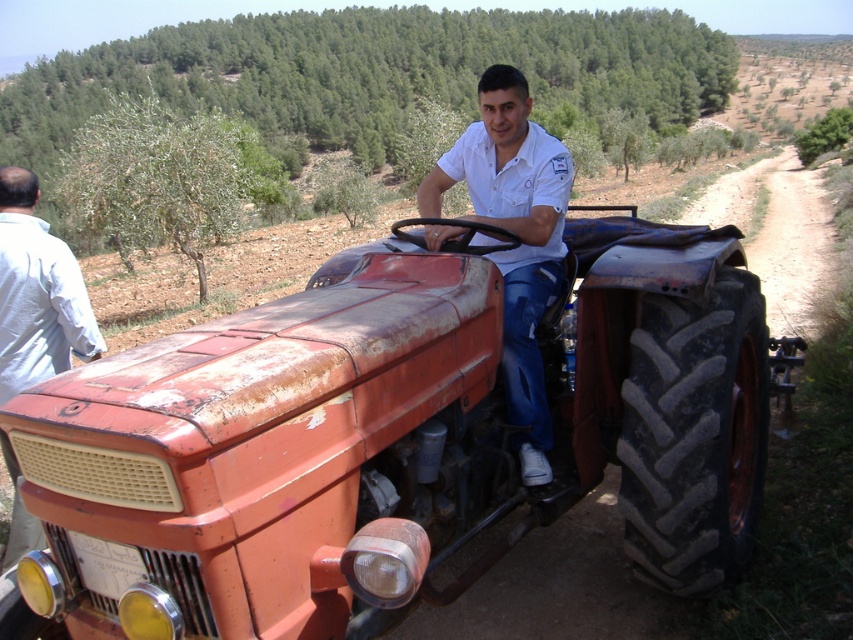
Question: Which point is farther from the camera taking this photo?

Choices:
 (A) (521, 152)
 (B) (18, 253)

Answer: (A)

Question: Which object appears closest to the camera in this image?

Choices:
 (A) rusty metal tractor at center
 (B) light blue shirt at left
 (C) white cotton shirt at center

Answer: (A)

Question: Which point is farther to the camera?

Choices:
 (A) light blue shirt at left
 (B) white cotton shirt at center
 (C) rusty metal tractor at center

Answer: (B)

Question: Can you confirm if rusty metal tractor at center is bigger than light blue shirt at left?

Choices:
 (A) yes
 (B) no

Answer: (A)

Question: Can you confirm if rusty metal tractor at center is smaller than white cotton shirt at center?

Choices:
 (A) no
 (B) yes

Answer: (A)

Question: In this image, where is white cotton shirt at center located relative to light blue shirt at left?

Choices:
 (A) right
 (B) left

Answer: (A)